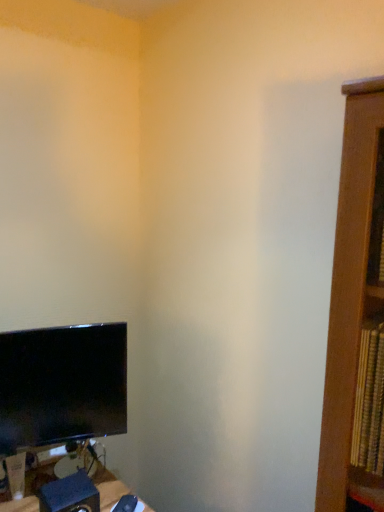
Question: From their relative heights in the image, would you say blue matte speaker at lower left is taller or shorter than black glossy monitor at lower left?

Choices:
 (A) tall
 (B) short

Answer: (B)

Question: From the image's perspective, is blue matte speaker at lower left located above or below black glossy monitor at lower left?

Choices:
 (A) above
 (B) below

Answer: (B)

Question: Do you think blue matte speaker at lower left is within black glossy monitor at lower left, or outside of it?

Choices:
 (A) outside
 (B) inside

Answer: (A)

Question: Considering the positions of point (120, 404) and point (92, 504), is point (120, 404) closer or farther from the camera than point (92, 504)?

Choices:
 (A) closer
 (B) farther

Answer: (B)

Question: Is black glossy monitor at lower left spatially inside blue matte speaker at lower left, or outside of it?

Choices:
 (A) outside
 (B) inside

Answer: (A)

Question: In terms of height, does black glossy monitor at lower left look taller or shorter compared to blue matte speaker at lower left?

Choices:
 (A) tall
 (B) short

Answer: (A)

Question: Based on their sizes in the image, would you say black glossy monitor at lower left is bigger or smaller than blue matte speaker at lower left?

Choices:
 (A) big
 (B) small

Answer: (A)